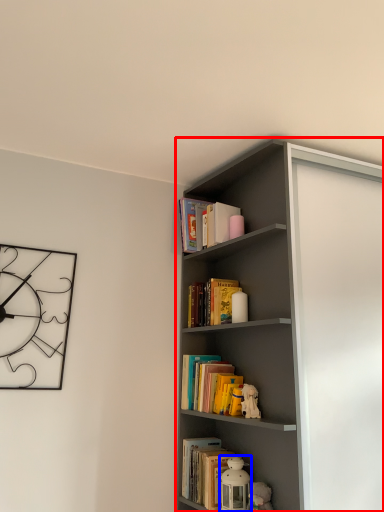
Question: Which point is further to the camera, shelf (highlighted by a red box) or toy (highlighted by a blue box)?

Choices:
 (A) shelf
 (B) toy

Answer: (B)